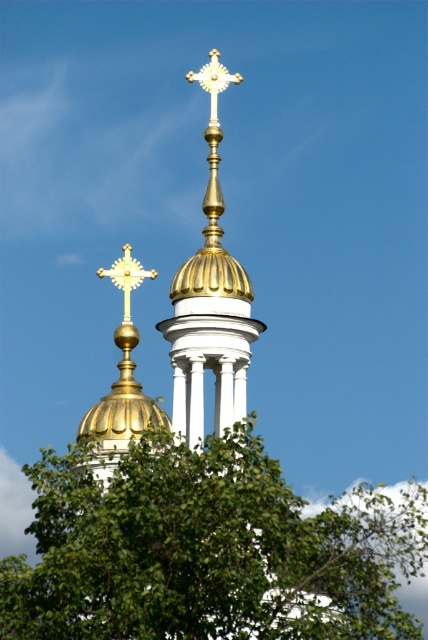
Can you confirm if green leafy tree at center is wider than gold polished metal cross at upper center?

Yes.

Between point (385, 621) and point (199, 72), which one is positioned in front?

Positioned in front is point (385, 621).

Where is `green leafy tree at center`? This screenshot has height=640, width=428. green leafy tree at center is located at coordinates (208, 550).

Who is higher up, gold metallic cross at upper center or gold polished metal cross at upper center?

Positioned higher is gold polished metal cross at upper center.

Who is positioned more to the left, gold metallic cross at upper center or gold polished metal cross at upper center?

gold metallic cross at upper center

Who is more distant from viewer, (118, 275) or (216, 104)?

The point (216, 104) is more distant.

The height and width of the screenshot is (640, 428). Identify the location of gold metallic cross at upper center. (125, 276).

This screenshot has height=640, width=428. Describe the element at coordinates (208, 550) in the screenshot. I see `green leafy tree at center` at that location.

Who is positioned more to the right, green leafy tree at center or gold metallic cross at upper center?

green leafy tree at center

Does point (38, 461) come behind point (130, 246)?

Yes, it is behind point (130, 246).

Image resolution: width=428 pixels, height=640 pixels. What are the coordinates of `green leafy tree at center` in the screenshot? It's located at (208, 550).